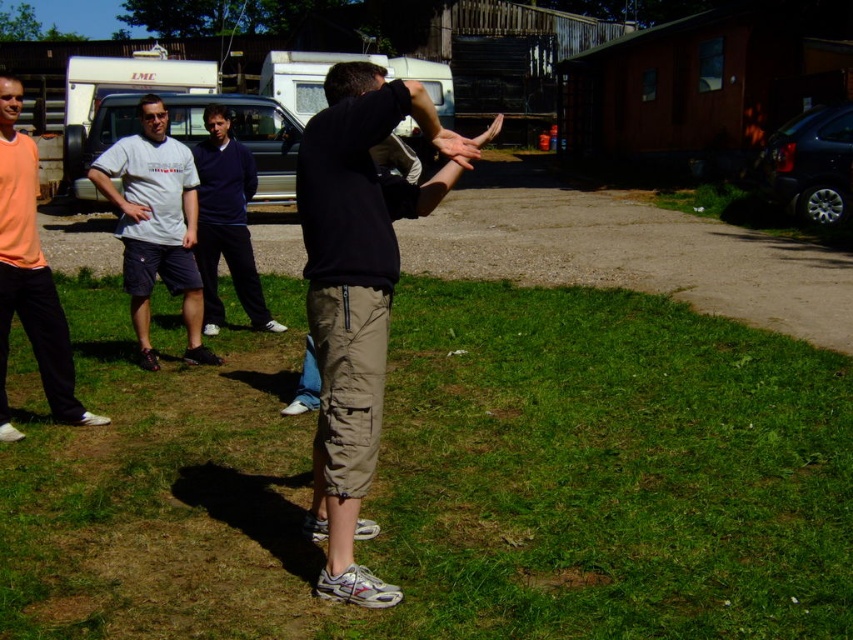
Question: Among these points, which one is nearest to the camera?

Choices:
 (A) (57, 376)
 (B) (131, 259)
 (C) (325, 387)

Answer: (C)

Question: Is black cotton t-shirt at center thinner than orange cotton shirt at left?

Choices:
 (A) yes
 (B) no

Answer: (B)

Question: Among these points, which one is nearest to the camera?

Choices:
 (A) (390, 125)
 (B) (451, 349)
 (C) (196, 228)

Answer: (A)

Question: Can you confirm if black cotton t-shirt at center is positioned to the left of dark blue sweatshirt at center?

Choices:
 (A) no
 (B) yes

Answer: (A)

Question: Can you confirm if white matte t-shirt at left is positioned to the left of dark blue sweatshirt at center?

Choices:
 (A) yes
 (B) no

Answer: (A)

Question: Among these points, which one is farthest from the camera?

Choices:
 (A) (703, 573)
 (B) (349, 573)

Answer: (A)